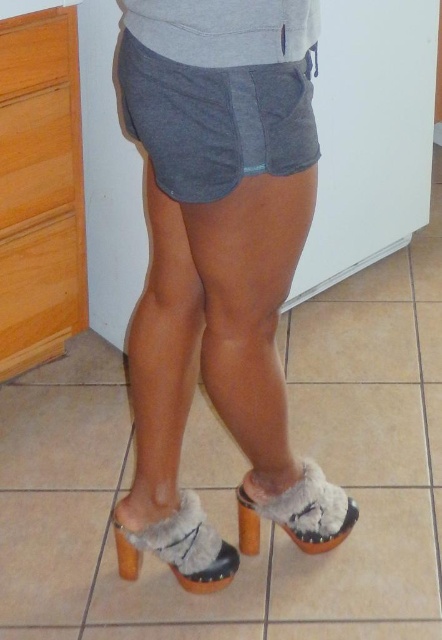
Question: Does gray cotton shorts at center appear under fuzzy fabric heel at lower center?

Choices:
 (A) yes
 (B) no

Answer: (B)

Question: Which object appears farthest from the camera in this image?

Choices:
 (A) matte gray hoodie at upper center
 (B) fuzzy fabric heel at lower center

Answer: (B)

Question: Can you confirm if matte gray hoodie at upper center is positioned above fuzzy suede clog at lower center?

Choices:
 (A) yes
 (B) no

Answer: (A)

Question: Which point is farther from the camera taking this photo?

Choices:
 (A) click(x=22, y=180)
 (B) click(x=137, y=552)
 (C) click(x=201, y=67)

Answer: (A)

Question: Among these points, which one is nearest to the camera?

Choices:
 (A) (133, 579)
 (B) (297, 516)
 (C) (144, 35)

Answer: (C)

Question: Is gray cotton shorts at center further to camera compared to fuzzy suede clog at lower center?

Choices:
 (A) yes
 (B) no

Answer: (B)